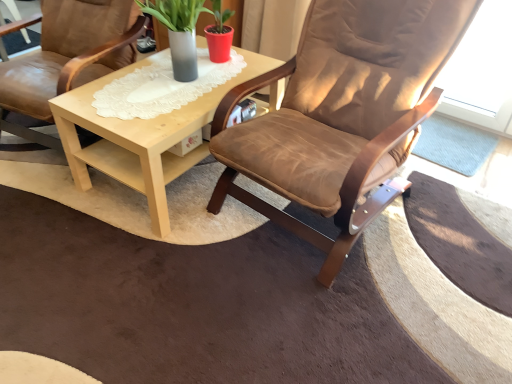
This screenshot has width=512, height=384. Identify the location of free space in front of brown leather chair at center, acting as the second chair starting from the right. 61,214.